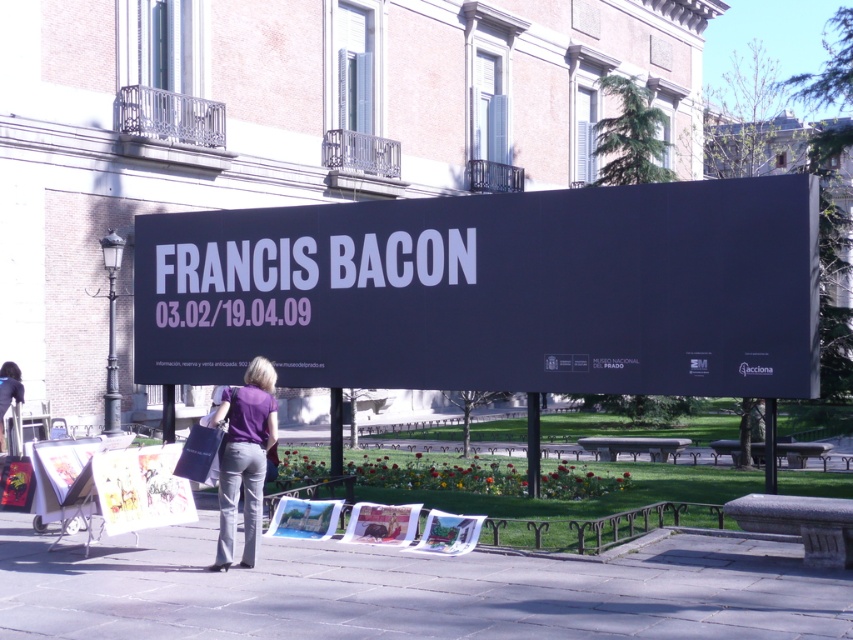
Question: Estimate the real-world distances between objects in this image. Which object is closer to the smooth concrete pavement at lower center?

Choices:
 (A) matte paper posters at lower left
 (B) purple fabric pants at lower center

Answer: (B)

Question: In this image, where is smooth concrete pavement at lower center located relative to purple fabric pants at lower center?

Choices:
 (A) left
 (B) right

Answer: (B)

Question: Does black matte sign at center have a lesser width compared to purple fabric pants at lower center?

Choices:
 (A) yes
 (B) no

Answer: (A)

Question: Observing the image, what is the correct spatial positioning of smooth concrete pavement at lower center in reference to matte paper posters at lower left?

Choices:
 (A) above
 (B) below

Answer: (B)

Question: Which object appears farthest from the camera in this image?

Choices:
 (A) matte black bag at lower left
 (B) black matte sign at center
 (C) matte paper posters at lower left
 (D) smooth concrete pavement at lower center

Answer: (A)

Question: Estimate the real-world distances between objects in this image. Which object is closer to the black matte sign at center?

Choices:
 (A) purple fabric pants at lower center
 (B) matte paper posters at lower left
 (C) matte black bag at lower left

Answer: (A)